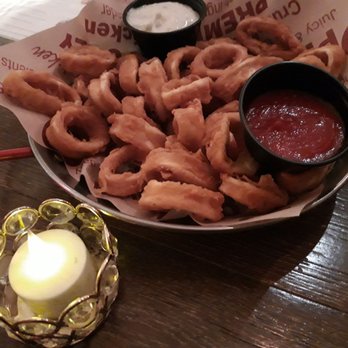
Locate an element on the screen. The width and height of the screenshot is (348, 348). candle flame is located at coordinates (37, 245).